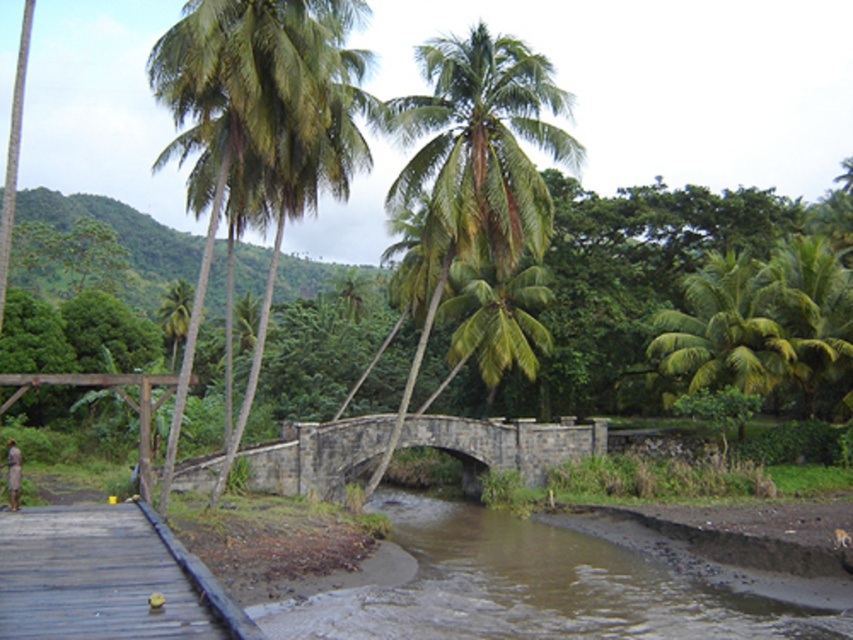
You are standing at the point marked by coordinates [505,444] in the image. Based on the scene description, what structure are you currently on?

The point marked by coordinates [505,444] is on the stone bridge at center.